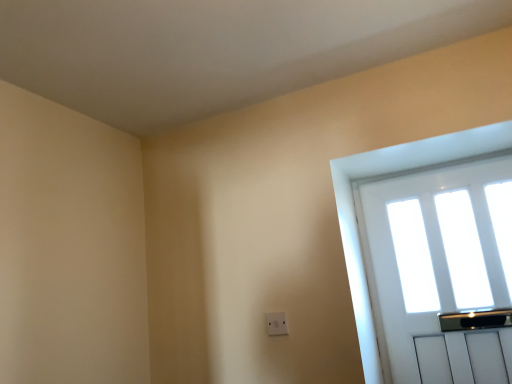
Question: Based on their positions, is white plastic electric outlet at center located to the left or right of white wooden door at upper right?

Choices:
 (A) right
 (B) left

Answer: (B)

Question: In terms of size, does white plastic electric outlet at center appear bigger or smaller than white wooden door at upper right?

Choices:
 (A) small
 (B) big

Answer: (A)

Question: Is white plastic electric outlet at center wider or thinner than white wooden door at upper right?

Choices:
 (A) wide
 (B) thin

Answer: (B)

Question: Considering the positions of point (449, 334) and point (282, 319), is point (449, 334) closer or farther from the camera than point (282, 319)?

Choices:
 (A) closer
 (B) farther

Answer: (B)

Question: Considering the positions of white wooden door at upper right and white plastic electric outlet at center in the image, is white wooden door at upper right bigger or smaller than white plastic electric outlet at center?

Choices:
 (A) big
 (B) small

Answer: (A)

Question: From their relative heights in the image, would you say white wooden door at upper right is taller or shorter than white plastic electric outlet at center?

Choices:
 (A) short
 (B) tall

Answer: (B)

Question: Considering the relative positions of white wooden door at upper right and white plastic electric outlet at center in the image provided, is white wooden door at upper right to the left or to the right of white plastic electric outlet at center?

Choices:
 (A) right
 (B) left

Answer: (A)